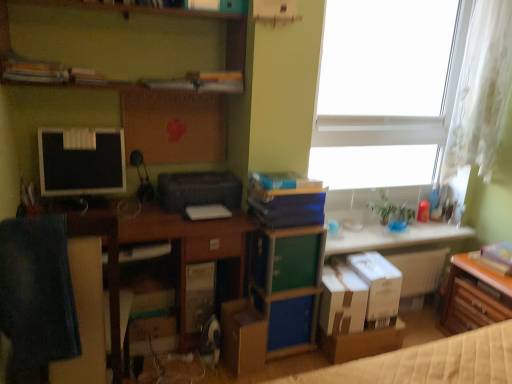
The width and height of the screenshot is (512, 384). I want to click on empty space that is ontop of blue hardcover book at center, which appears as the second book when viewed from the right (from a real-world perspective), so (x=286, y=181).